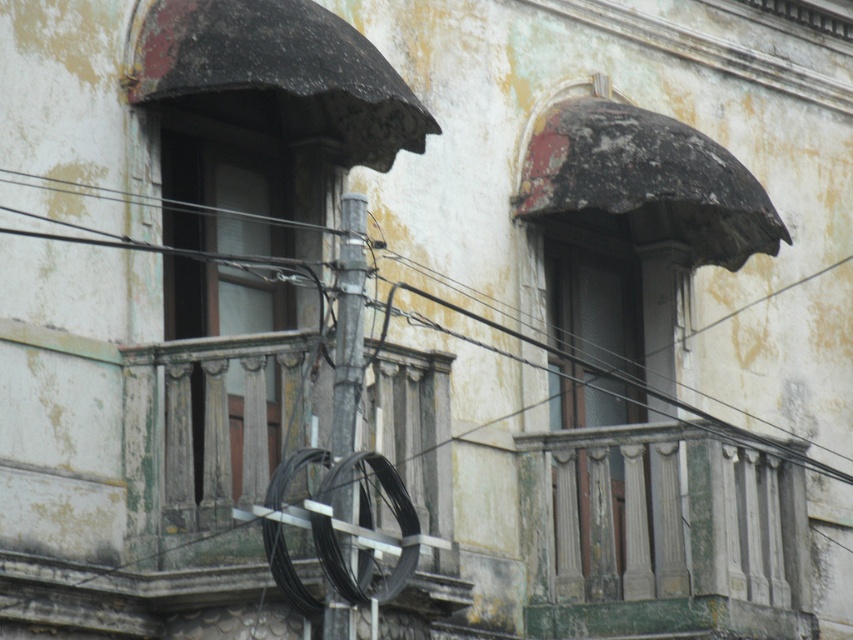
You are a maintenance worker assessing the building facade and the utility pole. You notice the black wire at center and the metallic gray pole at center. Which object is positioned higher in the scene?

The black wire at center is much taller than the metallic gray pole at center, so the black wire at center is positioned higher in the scene.

You are a maintenance worker assessing the building facade. You notice the rusty metal awning at upper right and the black wire at left. Which object is positioned higher in the scene?

The rusty metal awning at upper right is positioned higher than the black wire at left because it is above it.